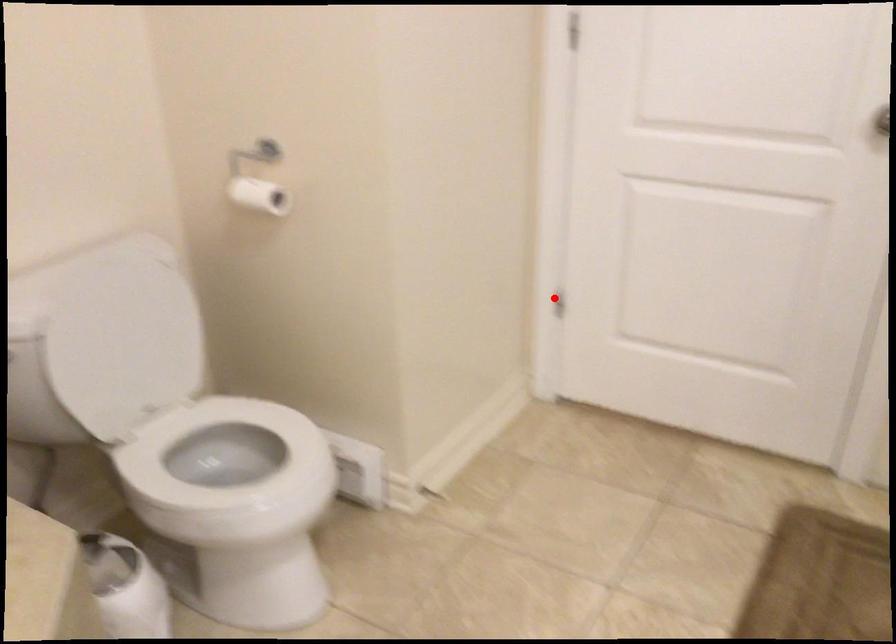
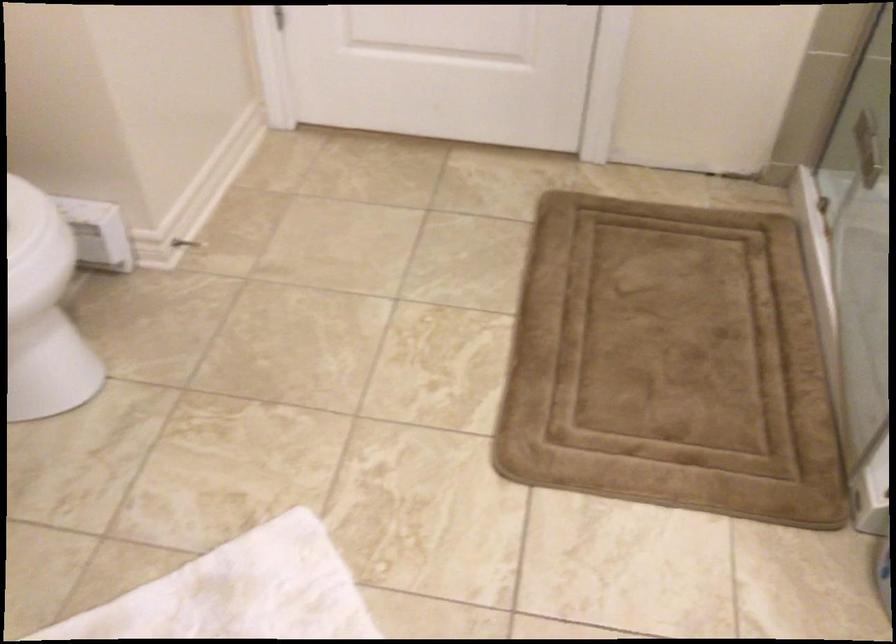
Where in the second image is the point corresponding to the highlighted location from the first image?

(274, 17)